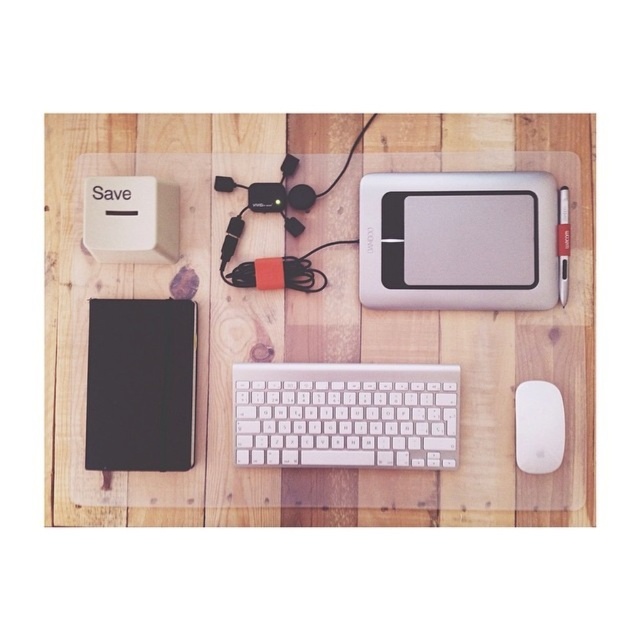
Is silver metallic drawing tablet at center closer to the viewer compared to black matte tablet at lower left?

Yes, it is in front of black matte tablet at lower left.

What do you see at coordinates (458, 241) in the screenshot?
I see `silver metallic drawing tablet at center` at bounding box center [458, 241].

This screenshot has width=640, height=640. In order to click on silver metallic drawing tablet at center in this screenshot , I will do `click(458, 241)`.

Is point (157, 353) in front of point (99, 248)?

No, (157, 353) is further to viewer.

Based on the photo, does black matte tablet at lower left come in front of white plastic save button at upper left?

That is False.

Between point (125, 317) and point (138, 198), which one is positioned behind?

Positioned behind is point (125, 317).

This screenshot has height=640, width=640. What are the coordinates of `black matte tablet at lower left` in the screenshot? It's located at (140, 385).

Does white plastic keyboard at center appear over black matte tablet at lower left?

No, white plastic keyboard at center is not above black matte tablet at lower left.

Between white plastic keyboard at center and black matte tablet at lower left, which one has more height?

Standing taller between the two is black matte tablet at lower left.

Locate an element on the screen. white plastic keyboard at center is located at coordinates (346, 413).

I want to click on white plastic keyboard at center, so [346, 413].